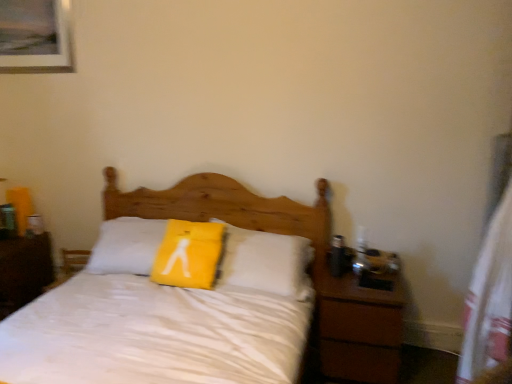
Question: Is yellow fabric pillow at center in front of brown wooden nightstand at right, placed as the 1th nightstand when sorted from right to left?

Choices:
 (A) yes
 (B) no

Answer: (B)

Question: Is yellow fabric pillow at center oriented away from brown wooden nightstand at right, which is the second nightstand from left to right?

Choices:
 (A) yes
 (B) no

Answer: (B)

Question: Is yellow fabric pillow at center to the right of brown wooden nightstand at right, placed as the 1th nightstand when sorted from right to left, from the viewer's perspective?

Choices:
 (A) no
 (B) yes

Answer: (A)

Question: Is yellow fabric pillow at center facing towards brown wooden nightstand at right, placed as the 1th nightstand when sorted from right to left?

Choices:
 (A) no
 (B) yes

Answer: (A)

Question: From a real-world perspective, is yellow fabric pillow at center below brown wooden nightstand at right, placed as the 1th nightstand when sorted from right to left?

Choices:
 (A) no
 (B) yes

Answer: (A)

Question: Is yellow fabric pillow at center positioned far away from brown wooden nightstand at right, which is the second nightstand from left to right?

Choices:
 (A) yes
 (B) no

Answer: (B)

Question: From a real-world perspective, is brown wood nightstand at left, which ranks as the 2th nightstand in right-to-left order, over white matte bed at center?

Choices:
 (A) no
 (B) yes

Answer: (A)

Question: Does brown wood nightstand at left, which is the 1th nightstand from left to right, have a larger size compared to white matte bed at center?

Choices:
 (A) no
 (B) yes

Answer: (A)

Question: Can you confirm if brown wood nightstand at left, which ranks as the 2th nightstand in right-to-left order, is wider than white matte bed at center?

Choices:
 (A) yes
 (B) no

Answer: (B)

Question: Is brown wood nightstand at left, which ranks as the 2th nightstand in right-to-left order, further to camera compared to white matte bed at center?

Choices:
 (A) yes
 (B) no

Answer: (A)

Question: From a real-world perspective, is brown wood nightstand at left, which ranks as the 2th nightstand in right-to-left order, positioned under white matte bed at center based on gravity?

Choices:
 (A) no
 (B) yes

Answer: (B)

Question: Can you confirm if brown wood nightstand at left, which ranks as the 2th nightstand in right-to-left order, is shorter than white matte bed at center?

Choices:
 (A) no
 (B) yes

Answer: (B)

Question: From a real-world perspective, does white matte bed at center sit lower than wooden picture frame at upper left?

Choices:
 (A) no
 (B) yes

Answer: (B)